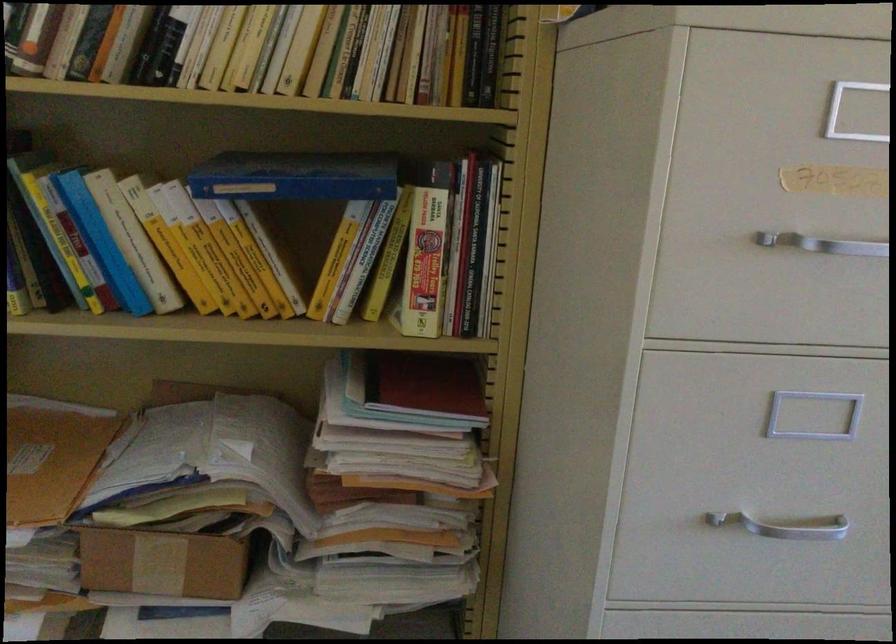
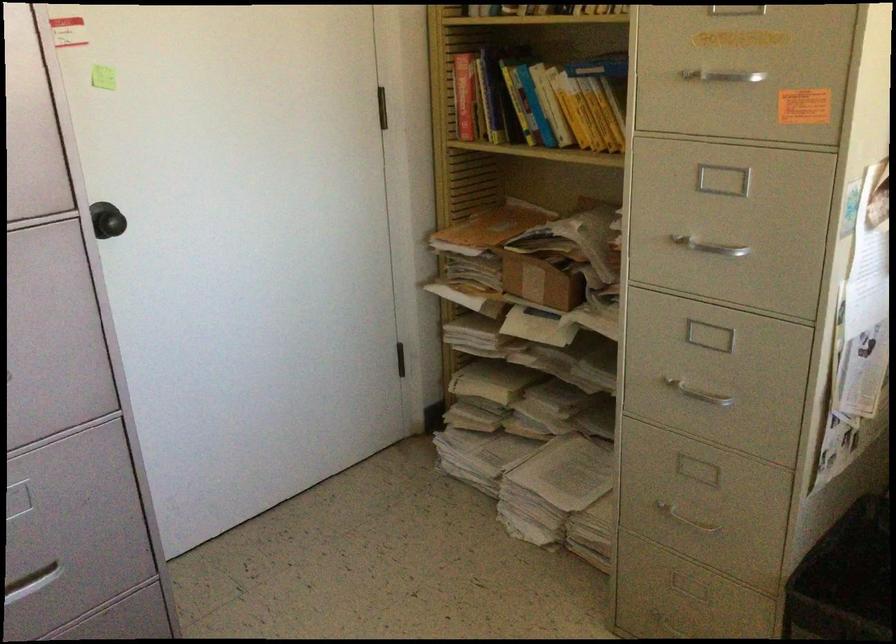
The point at (x=96, y=261) is marked in the first image. Where is the corresponding point in the second image?

(523, 111)